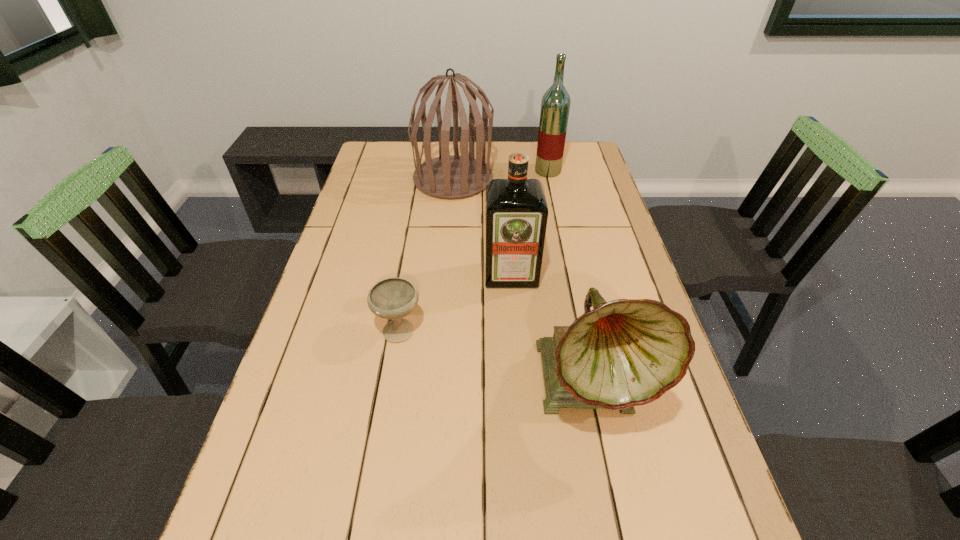
Where is `the farther liquor`? This screenshot has height=540, width=960. the farther liquor is located at coordinates (555, 105).

Where is `birdcage`? The height and width of the screenshot is (540, 960). birdcage is located at coordinates (448, 176).

The height and width of the screenshot is (540, 960). Find the location of `the left liquor`. the left liquor is located at coordinates (516, 212).

Where is `the third farthest object`? the third farthest object is located at coordinates (516, 212).

I want to click on record player, so click(628, 352).

At what (x,y) coordinates should I click in order to perform the action: click on chalice. Please return your answer as a coordinate pair (x, y). The height and width of the screenshot is (540, 960). Looking at the image, I should click on (393, 298).

Identify the location of vacant space situated 0.230m on the left of the farther liquor. The image size is (960, 540). (471, 171).

Identify the location of free space located on the front of the birdcage. (449, 228).

You are a GUI agent. You are given a task and a screenshot of the screen. Output one action in this format:
    pyautogui.click(x=<x>, y=<y>)
    Task: Click on the vacant point located on the front label of the nearer liquor
    The width and height of the screenshot is (960, 540).
    Given the screenshot: What is the action you would take?
    pyautogui.click(x=521, y=409)

Identify the location of free point located from the horn of the record player. This screenshot has height=540, width=960. (614, 511).